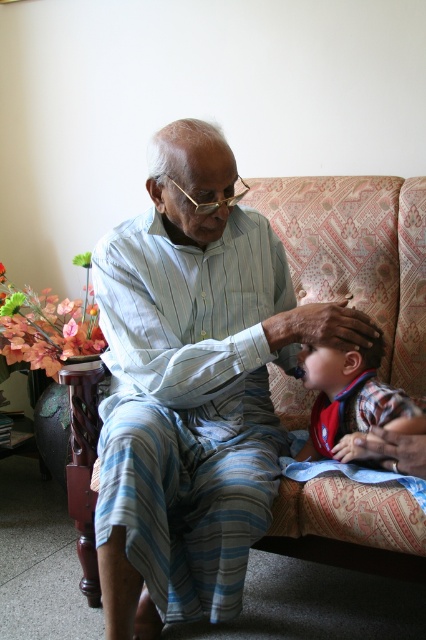
You are a photographer standing in front of the sofa. You want to take a closeup photo of the point at coordinates point (x=164, y=493) and point (x=322, y=358). Which point should you focus on first to ensure it is in sharp focus?

Point (x=164, y=493) is closer to the camera than point (x=322, y=358), so you should focus on point (x=164, y=493) first to ensure it is in sharp focus.

You are a photographer trying to capture a closeup of the light blue striped pajamas at center and the plaid fabric shirt at lower right. Which one is covering the other in the image?

The light blue striped pajamas at center is positioned over plaid fabric shirt at lower right, so the pajamas are covering the shirt.